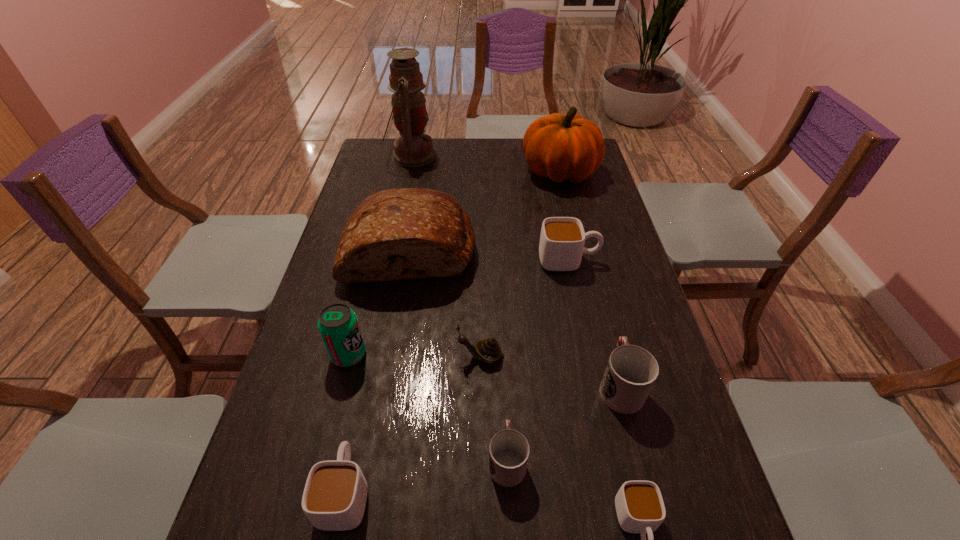
Find the location of `object that is positioned at the far right corner`. object that is positioned at the far right corner is located at coordinates (562, 147).

Locate an element on the screen. vacant space at the far edge of the desktop is located at coordinates (492, 165).

This screenshot has height=540, width=960. In the image, there is a desktop. In order to click on vacant space at the left edge in this screenshot , I will do `click(327, 296)`.

Find the location of a particular element. vacant space at the right edge of the desktop is located at coordinates (591, 316).

Where is `vacant space at the far left corner of the desktop`? The height and width of the screenshot is (540, 960). vacant space at the far left corner of the desktop is located at coordinates (376, 165).

In order to click on free space between the third tallest object and the fourth nearest cup in this screenshot , I will do `click(515, 316)`.

Find the location of `vacant space that's between the second biggest white cup and the gray snail`. vacant space that's between the second biggest white cup and the gray snail is located at coordinates (413, 424).

This screenshot has height=540, width=960. I want to click on vacant space in between the pop soda and the left red cup, so click(428, 407).

Locate an element on the screen. The image size is (960, 540). free area in between the ninth shortest object and the leftmost cup is located at coordinates (452, 332).

Identify the location of vacant area that lies between the bread and the farthest white cup. The width and height of the screenshot is (960, 540). pos(490,254).